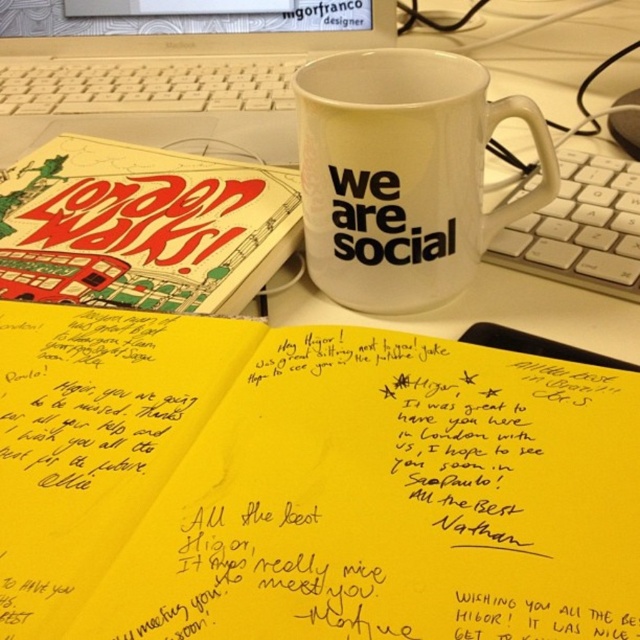
You are organizing your desk and need to place a new item between the yellow paper notebook at center and the white plastic laptop at upper center. Based on their positions, which object should the new item be placed closer to?

The new item should be placed closer to the white plastic laptop at upper center because the yellow paper notebook at center is to the right of it, meaning the laptop is on the left side. Therefore, placing the new item between them would require positioning it closer to the laptop to maintain the left to right order.

You are organizing your desk and want to place a new folder between the yellow paper notebook at center and the white plastic laptop at upper center. Based on their positions, where should you place the folder?

The yellow paper notebook at center is in front of the white plastic laptop at upper center. Therefore, to place the folder between them, you should position it between the yellow paper notebook at center and the white plastic laptop at upper center, ensuring it is behind the notebook but in front of the laptop.

You are a delivery robot navigating a workspace. You need to move from the starting point at point (312, 32) to the delivery point at point (616, 227). However, there is an obstacle in the way. Which point is closer to you when you start?

Point (312, 32) is the starting point, so it is closer to you initially. The delivery point at (616, 227) is further away and requires navigating around the obstacle.